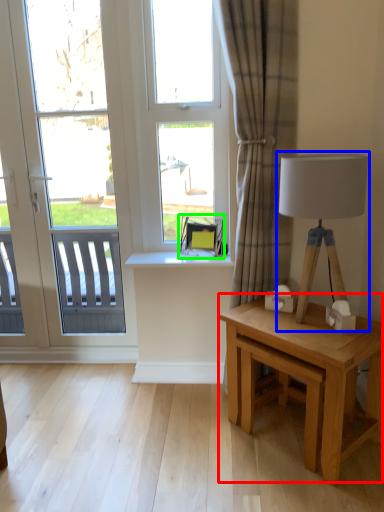
Question: Based on their relative distances, which object is farther from table (highlighted by a red box)? Choose from table lamp (highlighted by a blue box) and swivel chair (highlighted by a green box).

Choices:
 (A) table lamp
 (B) swivel chair

Answer: (B)